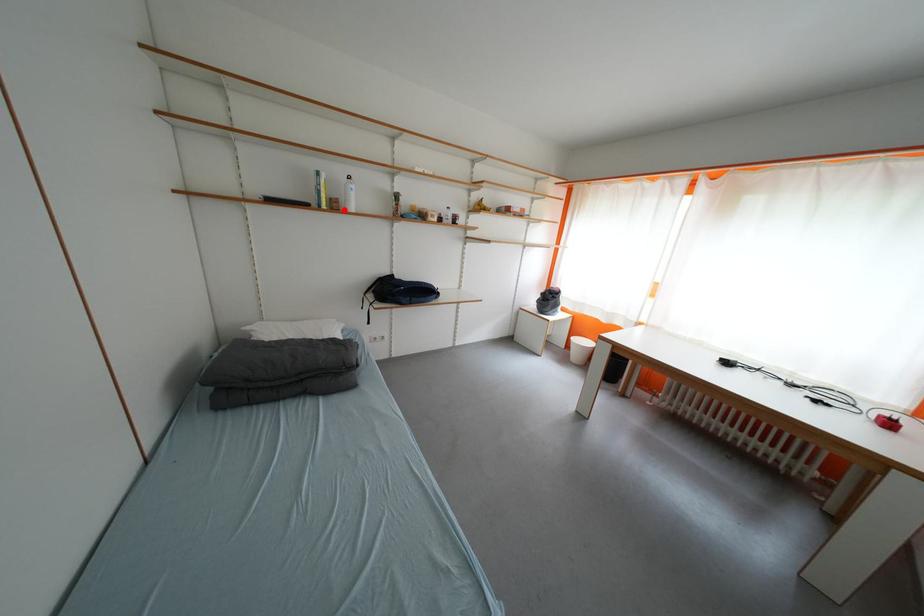
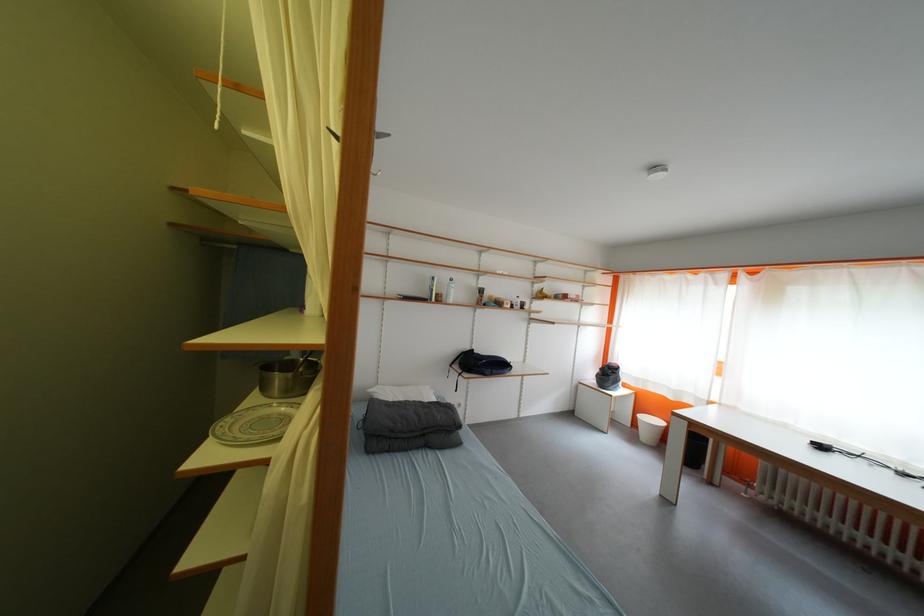
Question: I am providing you with two images of the same scene from different viewpoints. A red point is marked on the first image. Is the red point's position out of view in image 2?

Choices:
 (A) Yes
 (B) No

Answer: (B)